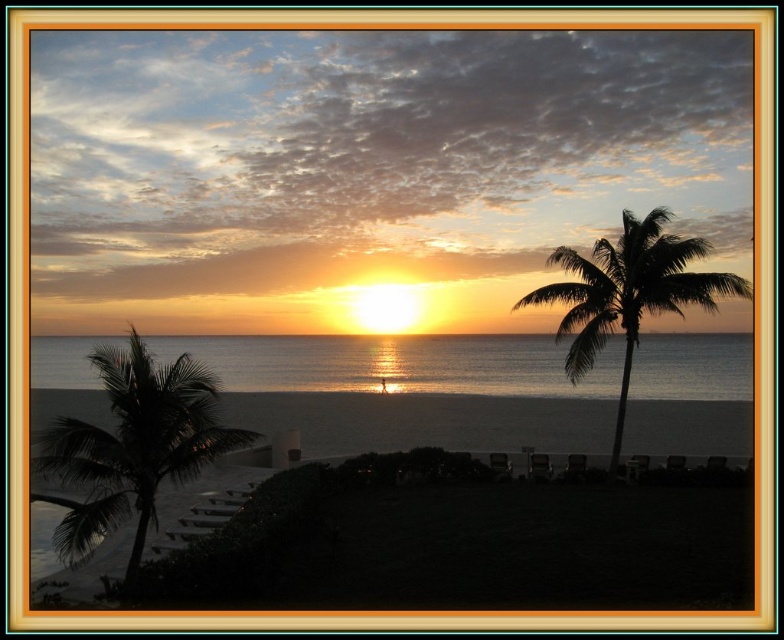
You are standing on the beach and want to take a photo of the silvery reflective water at center and the green leafy palm tree at lower left. Which object appears closer to the camera in the photo?

The green leafy palm tree at lower left appears closer to the camera because it is taller than the silvery reflective water at center.

You are standing on the beach and want to take a photo of the silvery reflective water at center. Based on its coordinates, where should you position yourself to capture it in the middle of your camera frame?

The silvery reflective water at center is located at coordinates point (396, 364), so you should position yourself so that the camera frame centers on that point to capture it in the middle.